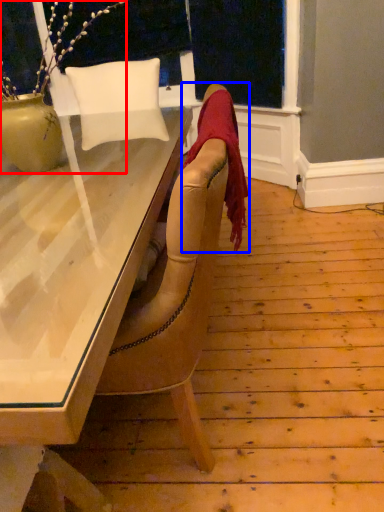
Question: Which object is further to the camera taking this photo, houseplant (highlighted by a red box) or blanket (highlighted by a blue box)?

Choices:
 (A) houseplant
 (B) blanket

Answer: (B)